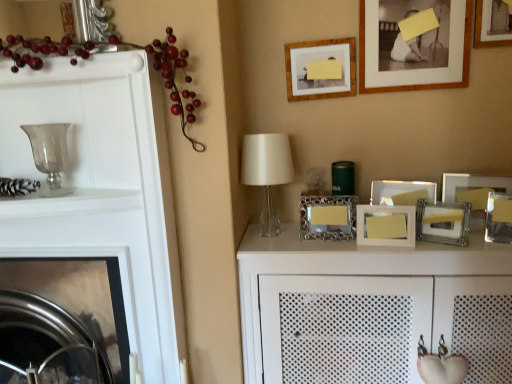
Question: Considering the relative positions of wooden picture frame at upper right, placed as the ninth picture frame when sorted from bottom to top, and wooden picture frame at center-right, which is the first picture frame in bottom-to-top order, in the image provided, is wooden picture frame at upper right, placed as the ninth picture frame when sorted from bottom to top, to the left or to the right of wooden picture frame at center-right, which is the first picture frame in bottom-to-top order,?

Choices:
 (A) left
 (B) right

Answer: (B)

Question: Is wooden picture frame at upper right, placed as the ninth picture frame when sorted from bottom to top, spatially inside wooden picture frame at center-right, the 9th picture frame from the top, or outside of it?

Choices:
 (A) outside
 (B) inside

Answer: (A)

Question: Estimate the real-world distances between objects in this image. Which object is closer to the metallic silver fireplace at left?

Choices:
 (A) transparent glass table lamp at center
 (B) silver metallic photo frame at center, which appears as the eighth picture frame when viewed from the top
 (C) metallic silver photo frame at center, which is the seventh picture frame from top to bottom
 (D) metallic silver picture frame at right, arranged as the 5th picture frame when viewed from the top
 (E) wooden picture frame at center-right, the 9th picture frame from the top

Answer: (A)

Question: Based on their relative distances, which object is nearer to the transparent glass candle holder at left?

Choices:
 (A) metallic silver fireplace at left
 (B) white textured cabinet at center
 (C) wooden picture frame at upper right, positioned as the first picture frame in top-to-bottom order
 (D) glossy plastic berries at left
 (E) silver metallic photo frame at center, marked as the second picture frame in a bottom-to-top arrangement

Answer: (D)